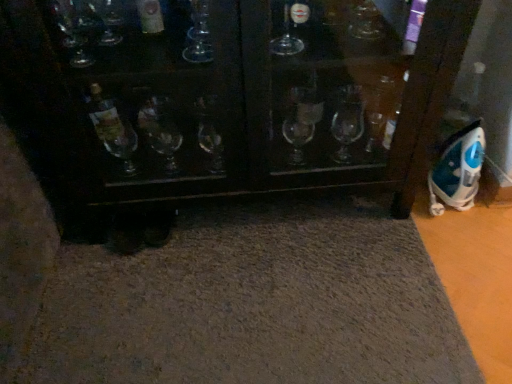
Find the location of a particular element. The width and height of the screenshot is (512, 384). vacant space in front of blue plastic iron at right is located at coordinates (460, 243).